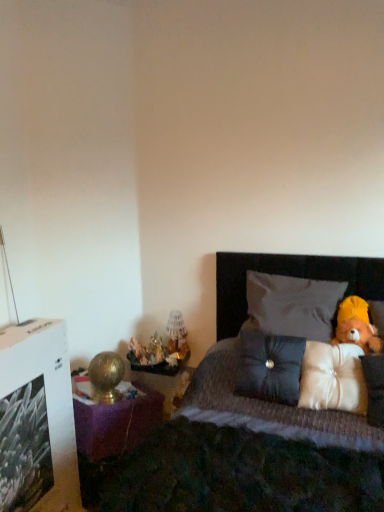
Question: Considering their positions, is white fabric pillow at upper right, which is the 3th pillow in bottom-to-top order, located in front of or behind matte gold figurine at left?

Choices:
 (A) behind
 (B) front

Answer: (B)

Question: In terms of size, does white fabric pillow at upper right, the 1th pillow viewed from the top, appear bigger or smaller than matte gold figurine at left?

Choices:
 (A) big
 (B) small

Answer: (A)

Question: Which is farther from the metallic gold figurines at left?

Choices:
 (A) satin white pillow at right, acting as the third pillow starting from the top
 (B) matte gold figurine at left
 (C) dark fabric bed at right
 (D) satin dark gray pillow at center, the second pillow when ordered from top to bottom
 (E) white fabric pillow at upper right, which is the 3th pillow in bottom-to-top order

Answer: (A)

Question: Which object is the closest to the satin dark gray pillow at center, the second pillow when ordered from top to bottom?

Choices:
 (A) white fabric pillow at upper right, the 1th pillow viewed from the top
 (B) satin white pillow at right, which ranks as the 1th pillow in bottom-to-top order
 (C) dark fabric bed at right
 (D) matte glass table lamp at center
 (E) metallic gold figurines at left

Answer: (B)